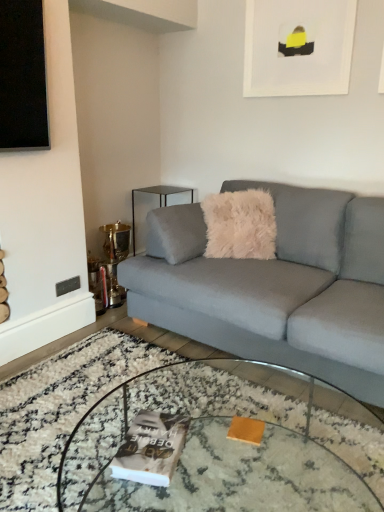
The image size is (384, 512). Find the location of `free space to the right of matte gray magazine at center`. free space to the right of matte gray magazine at center is located at coordinates (212, 456).